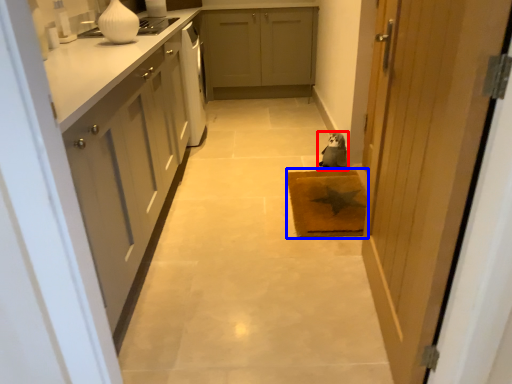
Question: Which object is further to the camera taking this photo, animal (highlighted by a red box) or doormat (highlighted by a blue box)?

Choices:
 (A) animal
 (B) doormat

Answer: (A)